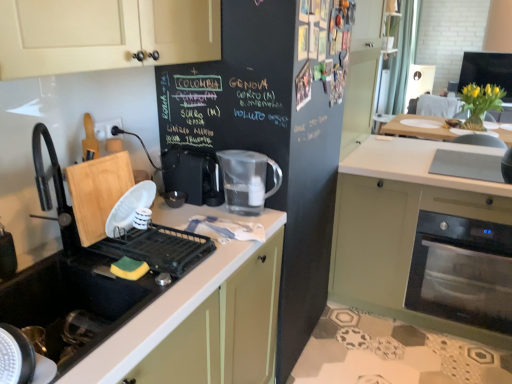
Measure the distance between point (163, 166) and camera.

The depth of point (163, 166) is 5.87 feet.

This screenshot has width=512, height=384. Describe the element at coordinates (401, 225) in the screenshot. I see `green matte oven at lower right` at that location.

This screenshot has width=512, height=384. Find the location of `black chalkboard at center`. black chalkboard at center is located at coordinates (266, 144).

From the image's perspective, relative to transparent plastic pitcher at center, is black plastic coffee machine at center above or below?

Clearly, from the image's perspective, black plastic coffee machine at center is above transparent plastic pitcher at center.

In terms of size, does black plastic coffee machine at center appear bigger or smaller than transparent plastic pitcher at center?

Considering their sizes, black plastic coffee machine at center takes up less space than transparent plastic pitcher at center.

Considering the positions of point (164, 154) and point (263, 190), is point (164, 154) closer or farther from the camera than point (263, 190)?

Point (164, 154) is farther from the camera than point (263, 190).

Is black plastic coffee machine at center to the left or to the right of transparent plastic pitcher at center in the image?

Based on their positions, black plastic coffee machine at center is located to the left of transparent plastic pitcher at center.

Can you confirm if black rubber sink at lower left is shorter than transparent plastic pitcher at center?

Yes, black rubber sink at lower left is shorter than transparent plastic pitcher at center.

Relative to transparent plastic pitcher at center, is black rubber sink at lower left in front or behind?

black rubber sink at lower left is positioned closer to the viewer than transparent plastic pitcher at center.

At what (x,y) coordinates should I click in order to perform the action: click on sink located in front of the transparent plastic pitcher at center. Please return your answer as a coordinate pair (x, y). The height and width of the screenshot is (384, 512). Looking at the image, I should click on (91, 274).

Does transparent plastic pitcher at center have a greater width compared to black plastic coffee machine at center?

No.

From their relative heights in the image, would you say transparent plastic pitcher at center is taller or shorter than black plastic coffee machine at center?

In the image, transparent plastic pitcher at center appears to be taller than black plastic coffee machine at center.

Are transparent plastic pitcher at center and black plastic coffee machine at center located far from each other?

No, there isn't a large distance between transparent plastic pitcher at center and black plastic coffee machine at center.

Choose the correct answer: Is transparent plastic pitcher at center inside black plastic coffee machine at center or outside it?

transparent plastic pitcher at center is spatially situated outside black plastic coffee machine at center.

Which object is positioned more to the right, stainless steel oven at lower right or black plastic coffee machine at center?

From the viewer's perspective, stainless steel oven at lower right appears more on the right side.

Is stainless steel oven at lower right looking in the opposite direction of black plastic coffee machine at center?

No, stainless steel oven at lower right is not facing the opposite direction of black plastic coffee machine at center.

Which is farther from the camera, (486,311) or (195,171)?

The point (486,311) is farther.

Would you say stainless steel oven at lower right is a long distance from black plastic coffee machine at center?

stainless steel oven at lower right is positioned a significant distance from black plastic coffee machine at center.

Is transparent plastic pitcher at center aimed at black chalkboard at center?

No, transparent plastic pitcher at center is not turned towards black chalkboard at center.

Considering the positions of objects transparent plastic pitcher at center and black chalkboard at center in the image provided, who is more to the left, transparent plastic pitcher at center or black chalkboard at center?

From the viewer's perspective, transparent plastic pitcher at center appears more on the left side.

From the image's perspective, which one is positioned lower, transparent plastic pitcher at center or black chalkboard at center?

From the image's view, transparent plastic pitcher at center is below.

Image resolution: width=512 pixels, height=384 pixels. I want to click on coffee machine located behind the black chalkboard at center, so click(x=192, y=175).

In the scene shown: Measure the distance from black plastic coffee machine at center to black chalkboard at center.

The distance of black plastic coffee machine at center from black chalkboard at center is 11.92 inches.

From a real-world perspective, is black plastic coffee machine at center physically below black chalkboard at center?

No, from a real-world perspective, black plastic coffee machine at center is not beneath black chalkboard at center.

Considering the relative sizes of black plastic coffee machine at center and black chalkboard at center in the image provided, is black plastic coffee machine at center taller than black chalkboard at center?

Incorrect, the height of black plastic coffee machine at center is not larger of that of black chalkboard at center.

Does black plastic coffee machine at center have a larger size compared to black rubber sink at lower left?

Actually, black plastic coffee machine at center might be smaller than black rubber sink at lower left.

Which object is positioned more to the left, black plastic coffee machine at center or black rubber sink at lower left?

black rubber sink at lower left is more to the left.

From a real-world perspective, is black plastic coffee machine at center located higher than black rubber sink at lower left?

Yes, from a real-world perspective, black plastic coffee machine at center is over black rubber sink at lower left

Find the location of a particular element. The width and height of the screenshot is (512, 384). kitchen appliance located above the black plastic coffee machine at center (from a real-world perspective) is located at coordinates (247, 180).

Locate an element on the screen. The width and height of the screenshot is (512, 384). kitchen appliance that is behind the black rubber sink at lower left is located at coordinates (247, 180).

Estimate the real-world distances between objects in this image. Which object is closer to black chalkboard at center, stainless steel oven at lower right or green matte oven at lower right?

green matte oven at lower right lies closer to black chalkboard at center than the other object.

Which object lies further to the anchor point black chalkboard at center, stainless steel oven at lower right or black plastic coffee machine at center?

Based on the image, stainless steel oven at lower right appears to be further to black chalkboard at center.

From the picture: Estimate the real-world distances between objects in this image. Which object is closer to stainless steel oven at lower right, black rubber sink at lower left or transparent plastic pitcher at center?

transparent plastic pitcher at center is closer to stainless steel oven at lower right.

Based on the photo, based on their spatial positions, is stainless steel oven at lower right or black rubber sink at lower left further from black chalkboard at center?

Among the two, stainless steel oven at lower right is located further to black chalkboard at center.

Which object lies further to the anchor point black plastic coffee machine at center, green matte oven at lower right or black chalkboard at center?

green matte oven at lower right is further to black plastic coffee machine at center.

Considering their positions, is green matte oven at lower right positioned further to transparent plastic pitcher at center than black rubber sink at lower left?

green matte oven at lower right is positioned further to the anchor transparent plastic pitcher at center.

Looking at the image, which one is located closer to black chalkboard at center, stainless steel oven at lower right or transparent plastic pitcher at center?

The object closer to black chalkboard at center is transparent plastic pitcher at center.

Estimate the real-world distances between objects in this image. Which object is further from black chalkboard at center, black rubber sink at lower left or transparent plastic pitcher at center?

black rubber sink at lower left.

The width and height of the screenshot is (512, 384). Find the location of `bulletin board between black rubber sink at lower left and transparent plastic pitcher at center from front to back`. bulletin board between black rubber sink at lower left and transparent plastic pitcher at center from front to back is located at coordinates (266, 144).

Identify the location of kitchen appliance positioned between black rubber sink at lower left and black plastic coffee machine at center from near to far. (247, 180).

Locate an element on the screen. Image resolution: width=512 pixels, height=384 pixels. kitchen appliance between black plastic coffee machine at center and stainless steel oven at lower right in the horizontal direction is located at coordinates (247, 180).

Find the location of a particular element. The height and width of the screenshot is (384, 512). coffee machine between black rubber sink at lower left and green matte oven at lower right in the horizontal direction is located at coordinates (192, 175).